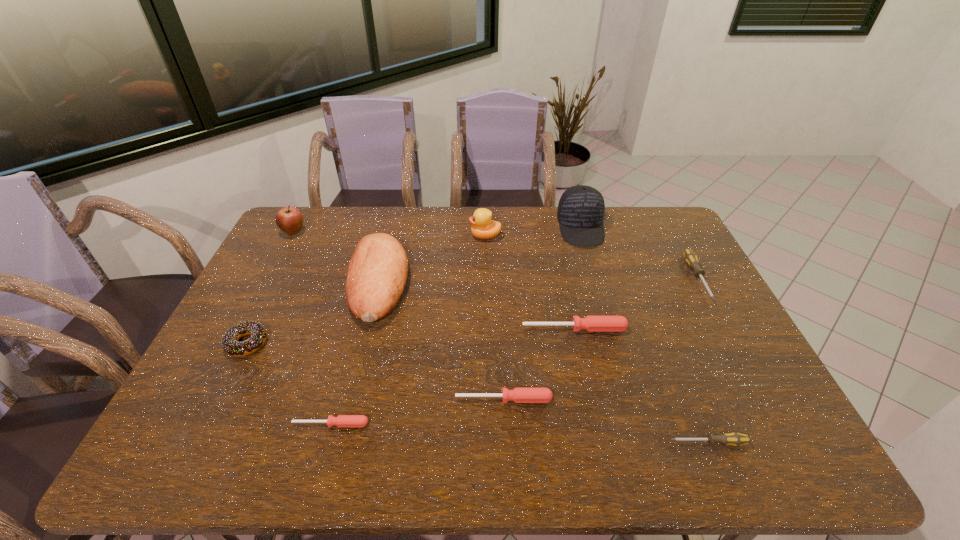
Identify the location of free region located 0.120m on the left of the light bread. (312, 282).

Where is `vacant space situated 0.220m at the tip of the rightmost object`? The width and height of the screenshot is (960, 540). vacant space situated 0.220m at the tip of the rightmost object is located at coordinates coord(744,364).

Find the location of `vacant area situated 0.400m on the back of the biggest red screwdriver`. vacant area situated 0.400m on the back of the biggest red screwdriver is located at coordinates (556, 240).

Find the location of a particular element. This screenshot has width=960, height=540. vacant area situated 0.220m on the right of the doughnut is located at coordinates (347, 343).

The width and height of the screenshot is (960, 540). What are the coordinates of `vacant position located on the left of the third farthest screwdriver` in the screenshot? It's located at (363, 399).

At what (x,y) coordinates should I click in order to perform the action: click on vacant space located 0.180m at the tip of the nearest object. Please return your answer as a coordinate pair (x, y). Image resolution: width=960 pixels, height=540 pixels. Looking at the image, I should click on (590, 443).

At what (x,y) coordinates should I click in order to perform the action: click on free region located 0.250m at the tip of the nearest object. Please return your answer as a coordinate pair (x, y). This screenshot has height=540, width=960. Looking at the image, I should click on (560, 443).

Where is `vacant region located 0.320m at the tip of the nearest object`? vacant region located 0.320m at the tip of the nearest object is located at coordinates (530, 443).

Find the location of a particular element. This screenshot has height=540, width=960. vacant area situated 0.100m on the left of the shortest object is located at coordinates (251, 424).

I want to click on baseball cap present at the far edge, so click(580, 214).